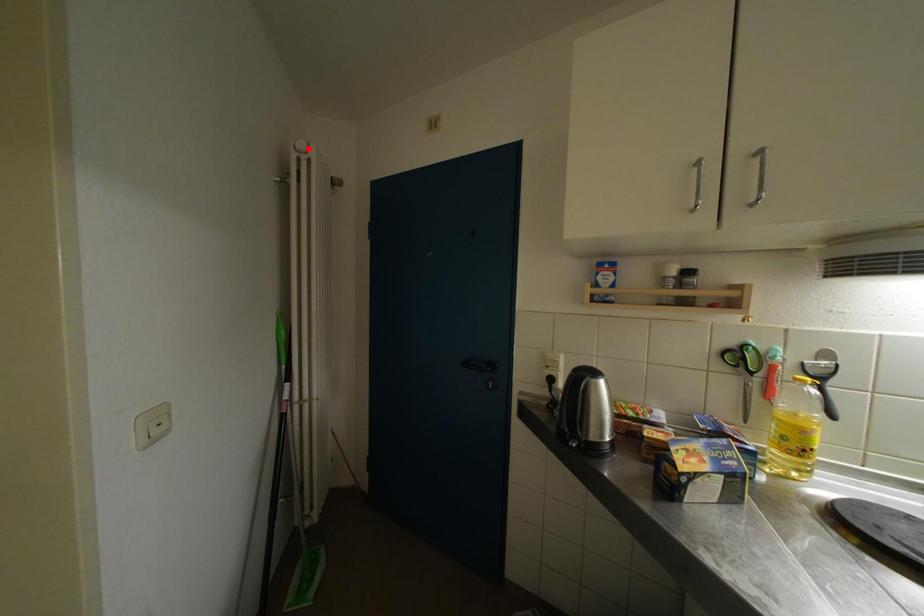
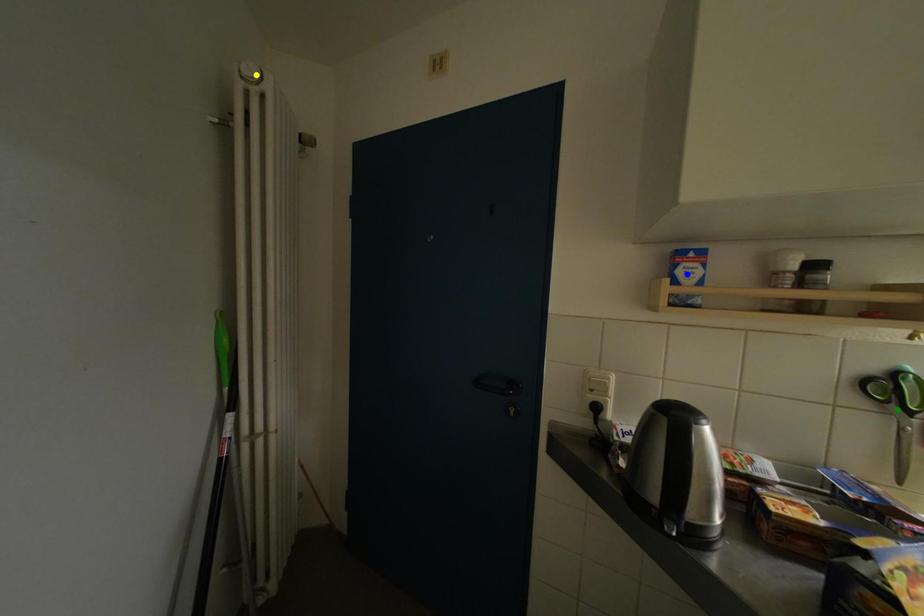
Question: I am providing you with two images of the same scene from different viewpoints. A red point is marked on the first image. You are given multiple points on the second image. Can you choose the point in image 2 that corresponds to the point in image 1?

Choices:
 (A) green point
 (B) yellow point
 (C) blue point

Answer: (B)